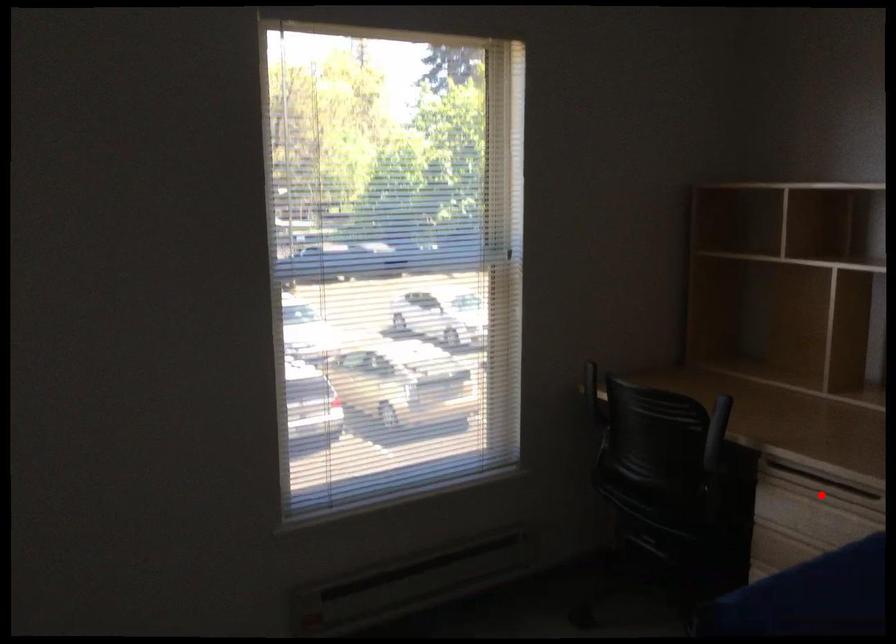
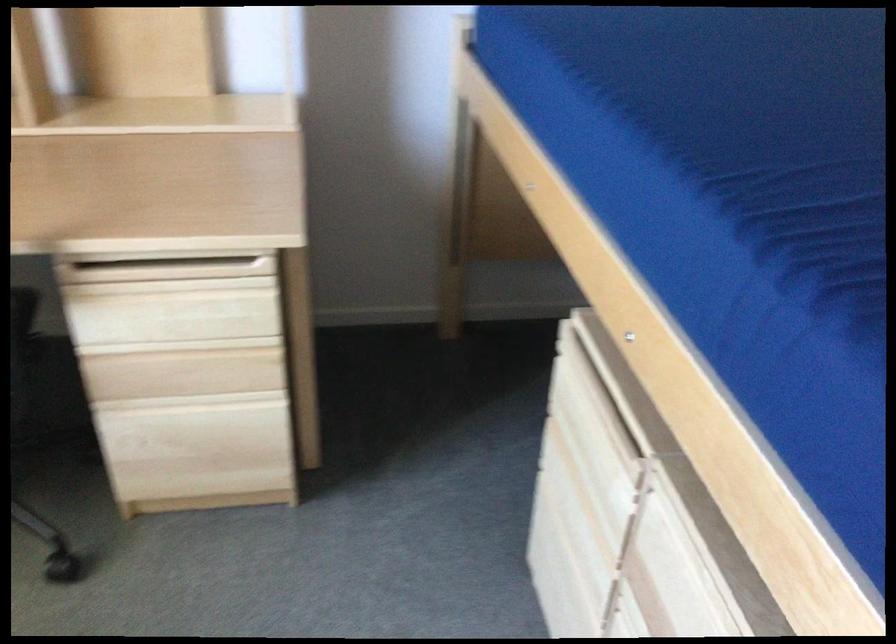
Question: I am providing you with two images of the same scene from different viewpoints. In image1, a red point is highlighted. Considering the same 3D point in image2, which of the following is correct?

Choices:
 (A) It is closer
 (B) It is farther

Answer: (A)